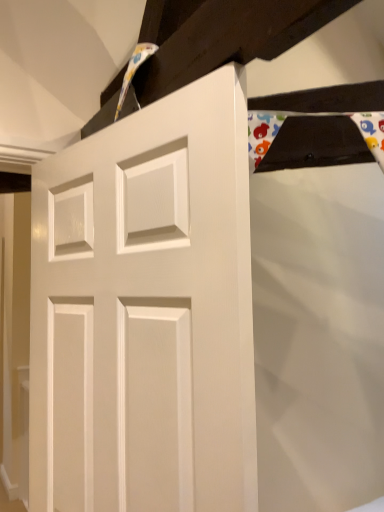
Question: Should I look upward or downward to see white glossy door at center?

Choices:
 (A) up
 (B) down

Answer: (B)